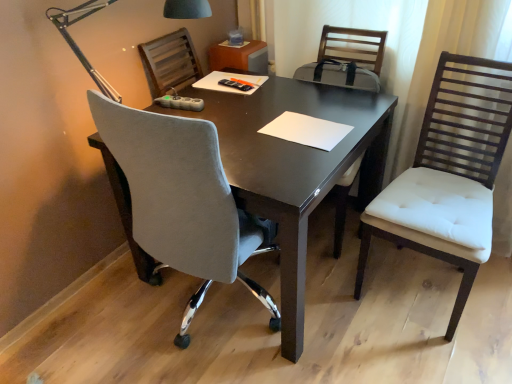
Question: Is white tufted cushion chair at right, acting as the 1th chair starting from the right, at the right side of white paper at center?

Choices:
 (A) no
 (B) yes

Answer: (B)

Question: Can you confirm if white tufted cushion chair at right, which is the second chair in left-to-right order, is thinner than white paper at center?

Choices:
 (A) no
 (B) yes

Answer: (A)

Question: From the image's perspective, would you say white tufted cushion chair at right, acting as the 1th chair starting from the right, is positioned over white paper at center?

Choices:
 (A) no
 (B) yes

Answer: (A)

Question: From a real-world perspective, is white tufted cushion chair at right, acting as the 1th chair starting from the right, over white paper at center?

Choices:
 (A) no
 (B) yes

Answer: (A)

Question: Is white tufted cushion chair at right, which is the second chair in left-to-right order, looking in the opposite direction of white paper at center?

Choices:
 (A) no
 (B) yes

Answer: (A)

Question: Visually, is white paper at center positioned to the left or to the right of metallic gray lamp at upper left?

Choices:
 (A) left
 (B) right

Answer: (B)

Question: From their relative heights in the image, would you say white paper at center is taller or shorter than metallic gray lamp at upper left?

Choices:
 (A) short
 (B) tall

Answer: (A)

Question: Looking at the image, does white paper at center seem bigger or smaller compared to metallic gray lamp at upper left?

Choices:
 (A) small
 (B) big

Answer: (A)

Question: Is white paper at center in front of or behind metallic gray lamp at upper left in the image?

Choices:
 (A) front
 (B) behind

Answer: (B)

Question: Is white tufted cushion chair at right, which is the second chair in left-to-right order, bigger or smaller than velvet grey chair at center, which ranks as the 1th chair in left-to-right order?

Choices:
 (A) small
 (B) big

Answer: (A)

Question: Does point (458, 142) appear closer or farther from the camera than point (95, 114)?

Choices:
 (A) farther
 (B) closer

Answer: (A)

Question: Looking at their shapes, would you say white tufted cushion chair at right, which is the second chair in left-to-right order, is wider or thinner than velvet grey chair at center, which ranks as the 1th chair in left-to-right order?

Choices:
 (A) thin
 (B) wide

Answer: (A)

Question: In terms of height, does white tufted cushion chair at right, which is the second chair in left-to-right order, look taller or shorter compared to velvet grey chair at center, which ranks as the 1th chair in left-to-right order?

Choices:
 (A) short
 (B) tall

Answer: (B)

Question: Is velvet grey chair at center, which ranks as the 1th chair in left-to-right order, spatially inside metallic gray lamp at upper left, or outside of it?

Choices:
 (A) outside
 (B) inside

Answer: (A)

Question: Is velvet grey chair at center, which ranks as the 1th chair in left-to-right order, wider or thinner than metallic gray lamp at upper left?

Choices:
 (A) wide
 (B) thin

Answer: (A)